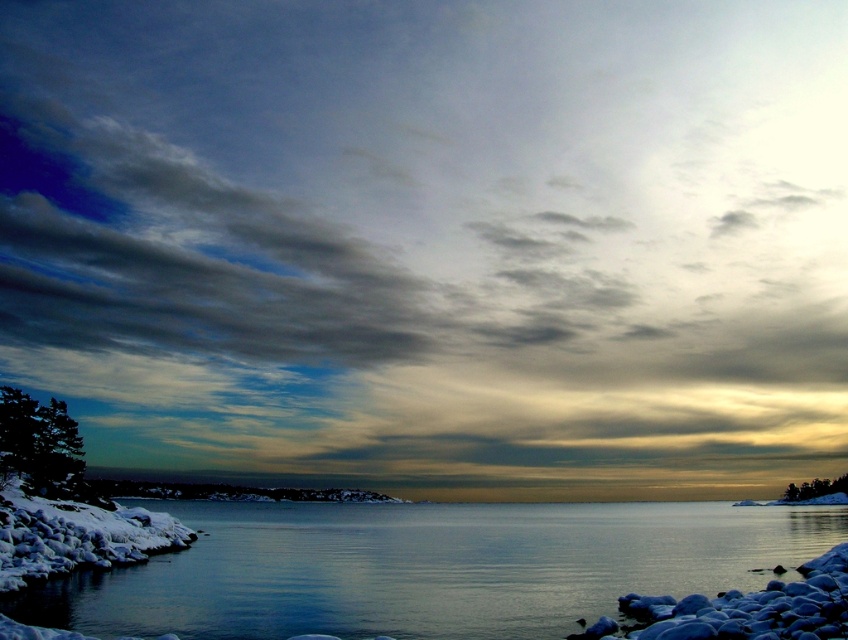
Is point (461, 634) closer to camera compared to point (812, 497)?

Yes, it is.

Between clear glass water at center and green matte tree at right, which one is positioned higher?

clear glass water at center is above.

Is point (727, 508) positioned behind point (789, 484)?

That is False.

Find the location of a particular element. This screenshot has height=640, width=848. clear glass water at center is located at coordinates (425, 566).

Which of these two, clear glass water at center or green matte tree at lower left, stands taller?

clear glass water at center is taller.

Does point (550, 563) come in front of point (38, 481)?

Yes, it is.

Where is `clear glass water at center`? This screenshot has height=640, width=848. clear glass water at center is located at coordinates (425, 566).

Can you confirm if green matte tree at lower left is thinner than green matte tree at right?

Indeed, green matte tree at lower left has a lesser width compared to green matte tree at right.

Is point (3, 390) positioned behind point (827, 483)?

No.

Image resolution: width=848 pixels, height=640 pixels. Find the location of `green matte tree at lower left`. green matte tree at lower left is located at coordinates (38, 445).